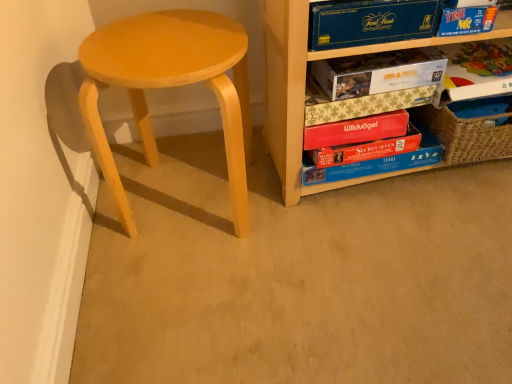
Question: Does matte cardboard puzzle box at center-right, the fourth paperback book from the top, have a smaller size compared to red matte wildvögel book at center, the 3th paperback book ordered from the bottom?

Choices:
 (A) no
 (B) yes

Answer: (A)

Question: Does matte cardboard puzzle box at center-right, which is the fourth paperback book from bottom to top, have a lesser width compared to red matte wildvögel book at center, the fifth paperback book in the top-to-bottom sequence?

Choices:
 (A) no
 (B) yes

Answer: (A)

Question: Can you confirm if matte cardboard puzzle box at center-right, which is the fourth paperback book from bottom to top, is shorter than red matte wildvögel book at center, the 3th paperback book ordered from the bottom?

Choices:
 (A) yes
 (B) no

Answer: (A)

Question: Is matte cardboard puzzle box at center-right, which is the fourth paperback book from bottom to top, in front of red matte wildvögel book at center, the 3th paperback book ordered from the bottom?

Choices:
 (A) no
 (B) yes

Answer: (B)

Question: From the image's perspective, is matte cardboard puzzle box at center-right, the fourth paperback book from the top, over red matte wildvögel book at center, the fifth paperback book in the top-to-bottom sequence?

Choices:
 (A) no
 (B) yes

Answer: (B)

Question: Is blue cardboard book at upper right, which appears as the 7th paperback book when ordered from the bottom, taller or shorter than wooden puzzle boxes at right?

Choices:
 (A) short
 (B) tall

Answer: (A)

Question: Relative to wooden puzzle boxes at right, is blue cardboard book at upper right, which appears as the 7th paperback book when ordered from the bottom, in front or behind?

Choices:
 (A) behind
 (B) front

Answer: (A)

Question: Looking at their shapes, would you say blue cardboard book at upper right, which appears as the 7th paperback book when ordered from the bottom, is wider or thinner than wooden puzzle boxes at right?

Choices:
 (A) thin
 (B) wide

Answer: (A)

Question: Do you think blue cardboard book at upper right, which appears as the first paperback book when viewed from the top, is within wooden puzzle boxes at right, or outside of it?

Choices:
 (A) inside
 (B) outside

Answer: (A)

Question: Is matte yellow stool at left inside the boundaries of wooden puzzle boxes at right, or outside?

Choices:
 (A) inside
 (B) outside

Answer: (B)

Question: Is matte yellow stool at left wider or thinner than wooden puzzle boxes at right?

Choices:
 (A) wide
 (B) thin

Answer: (A)

Question: Is point (160, 84) closer or farther from the camera than point (330, 54)?

Choices:
 (A) farther
 (B) closer

Answer: (B)

Question: From a real-world perspective, is matte yellow stool at left physically located above or below wooden puzzle boxes at right?

Choices:
 (A) below
 (B) above

Answer: (A)

Question: Is blue cardboard book at upper right, which appears as the 7th paperback book when ordered from the bottom, bigger or smaller than matte yellow stool at left?

Choices:
 (A) big
 (B) small

Answer: (B)

Question: In the image, is blue cardboard book at upper right, which appears as the first paperback book when viewed from the top, positioned in front of or behind matte yellow stool at left?

Choices:
 (A) behind
 (B) front

Answer: (A)